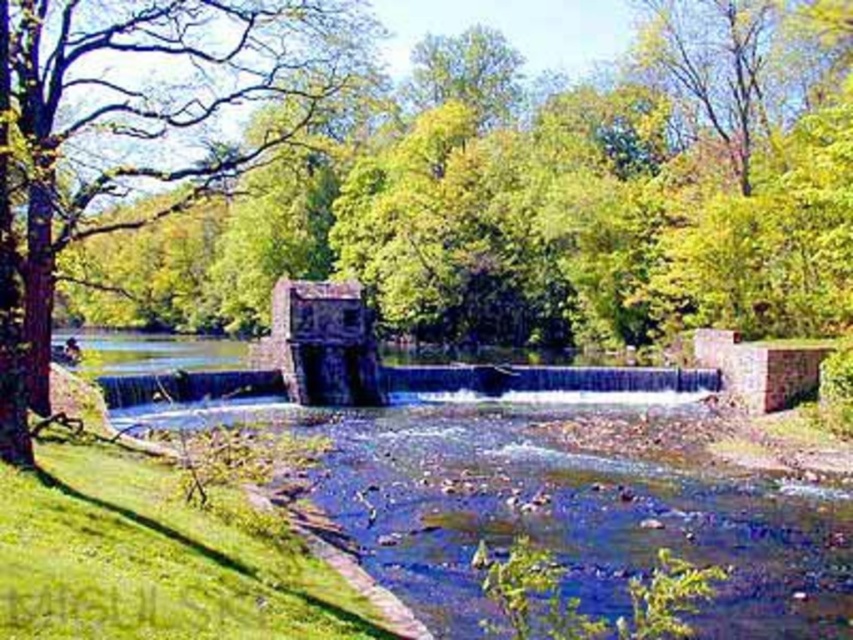
Is green leafy tree at center below green leafy tree at left?

Yes, green leafy tree at center is below green leafy tree at left.

Does green leafy tree at center have a lesser height compared to green leafy tree at left?

No, green leafy tree at center is not shorter than green leafy tree at left.

Measure the distance between green leafy tree at center and camera.

green leafy tree at center is 15.07 meters from camera.

The image size is (853, 640). Identify the location of green leafy tree at center. (566, 195).